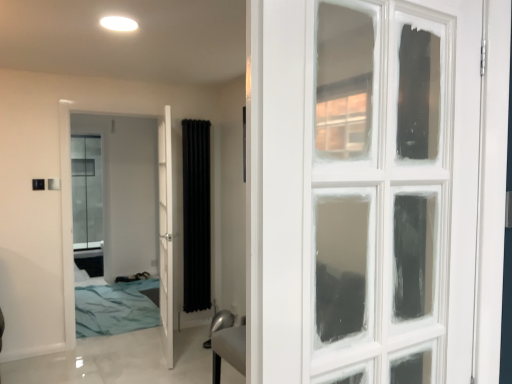
Identify the location of vacant space in front of white glossy door at center, which ranks as the 1th door in right-to-left order. (154, 370).